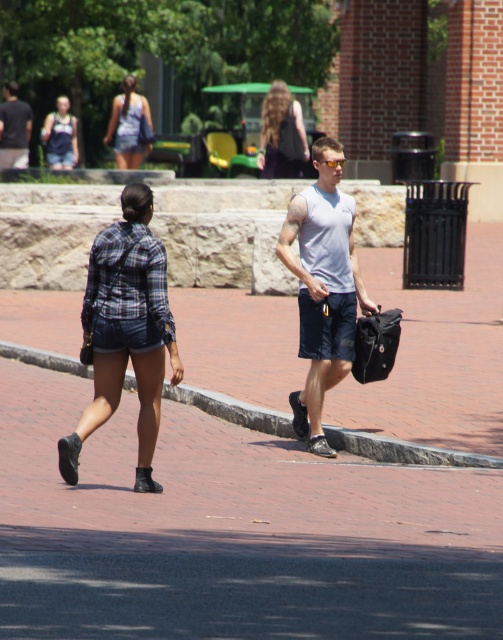
Who is taller, brick at lower center or matte black backpack at upper center?

matte black backpack at upper center is taller.

Is point (202, 388) positioned in front of point (285, 106)?

That is True.

I want to click on brick at lower center, so click(x=403, y=451).

What do you see at coordinates (282, 134) in the screenshot?
I see `matte black backpack at upper center` at bounding box center [282, 134].

Is matte black backpack at upper center closer to camera compared to matte gray tank top at upper left?

Yes, it is in front of matte gray tank top at upper left.

You are a GUI agent. You are given a task and a screenshot of the screen. Output one action in this format:
    pyautogui.click(x=<x>, y=<y>)
    Task: Click on the matte black backpack at upper center
    The image size is (503, 640).
    Given the screenshot: What is the action you would take?
    pyautogui.click(x=282, y=134)

This screenshot has height=640, width=503. What are the coordinates of `matte black backpack at upper center` in the screenshot? It's located at (282, 134).

Which is below, plaid fabric shirt at upper center or matte gray tank top at upper left?

matte gray tank top at upper left is lower down.

Does plaid fabric shirt at upper center appear on the left side of matte gray tank top at upper left?

In fact, plaid fabric shirt at upper center is to the right of matte gray tank top at upper left.

Does point (132, 97) come farther from viewer compared to point (12, 88)?

Yes, it is behind point (12, 88).

The image size is (503, 640). In order to click on plaid fabric shirt at upper center in this screenshot , I will do `click(127, 125)`.